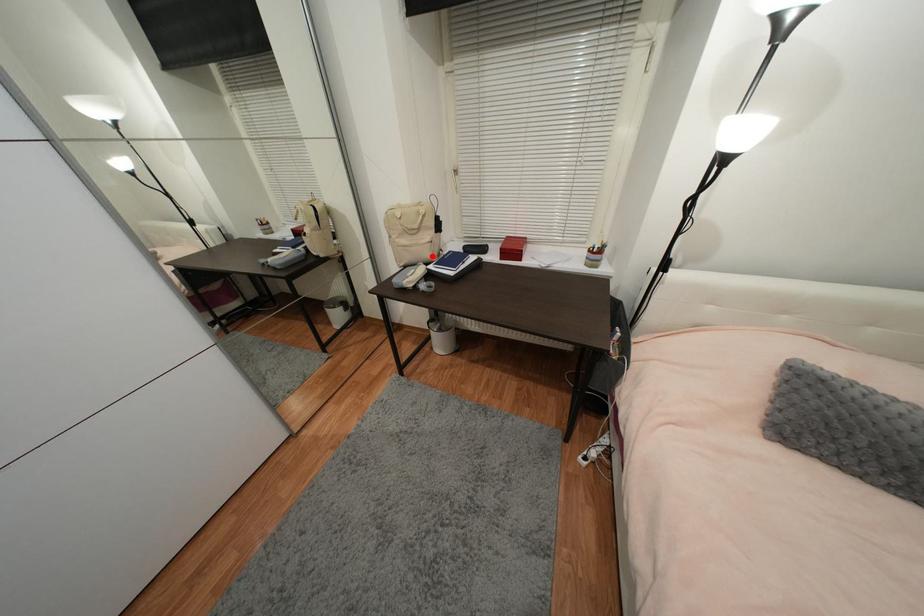
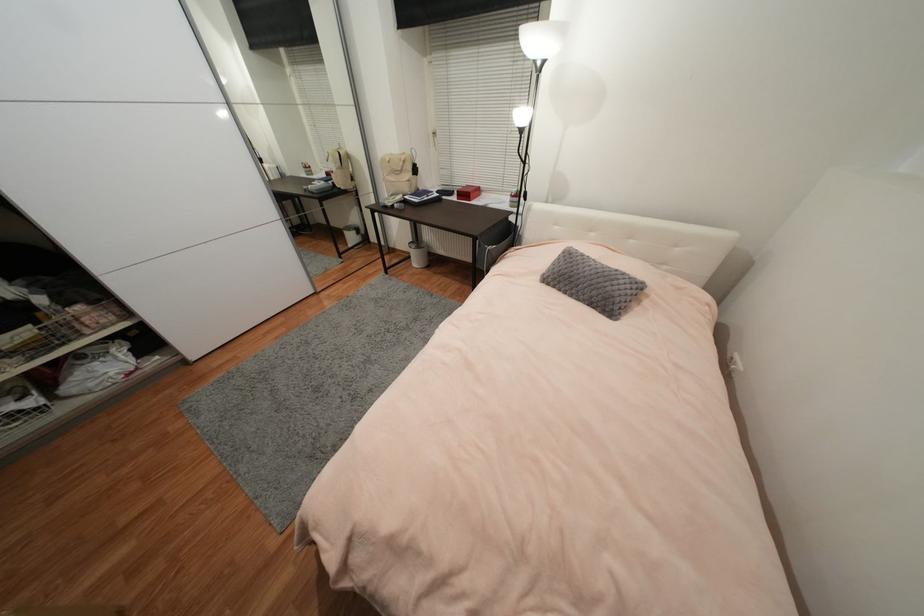
Question: I am providing you with two images of the same scene from different viewpoints. In image1, a red point is highlighted. Considering the same 3D point in image2, which of the following is correct?

Choices:
 (A) It is closer
 (B) It is farther

Answer: (A)